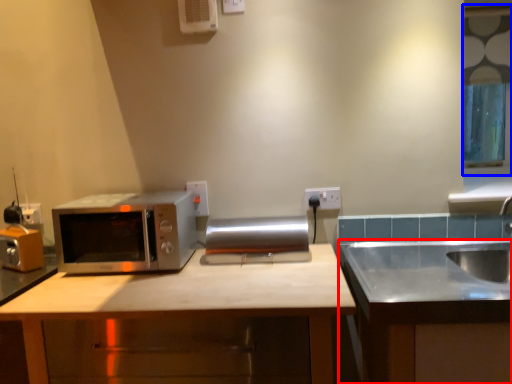
Question: Which object appears closest to the camera in this image, cabinetry (highlighted by a red box) or window (highlighted by a blue box)?

Choices:
 (A) cabinetry
 (B) window

Answer: (A)